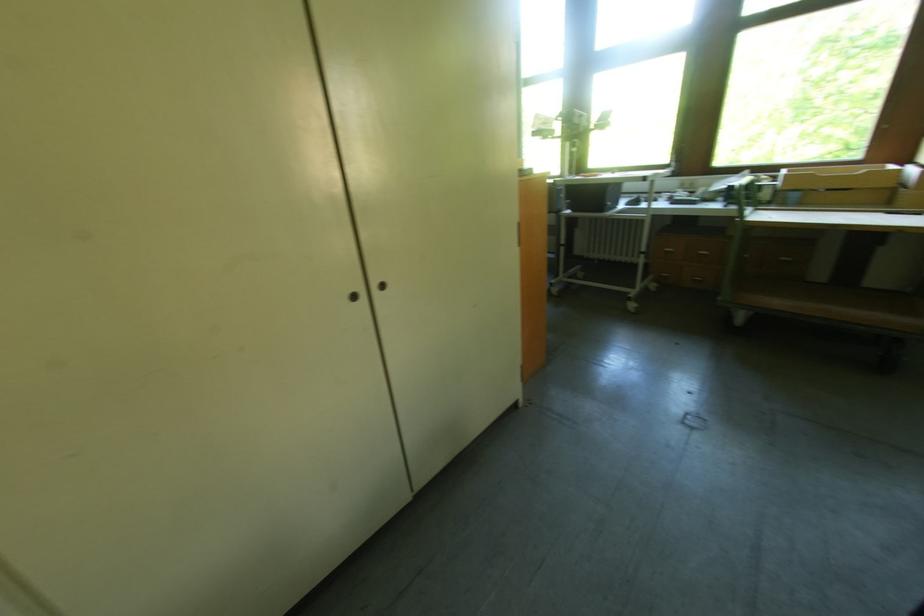
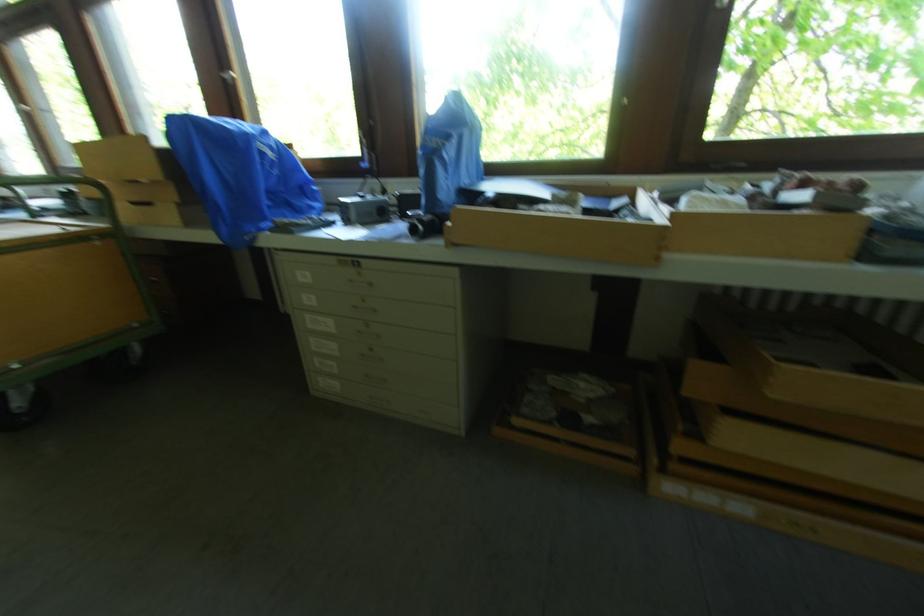
Question: What movement of the cameraman would produce the second image?

Choices:
 (A) Left
 (B) Right
 (C) Forward
 (D) Backward

Answer: (B)